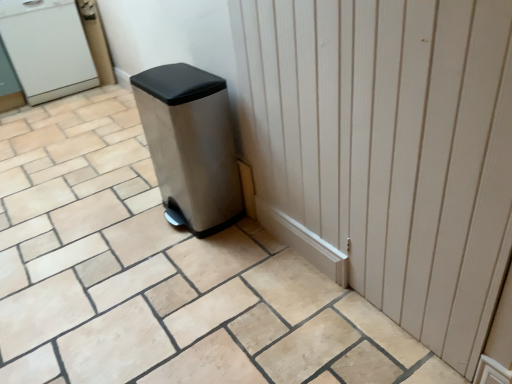
Image resolution: width=512 pixels, height=384 pixels. Find the location of `free space to the left of stainless steel trash can at center`. free space to the left of stainless steel trash can at center is located at coordinates (123, 226).